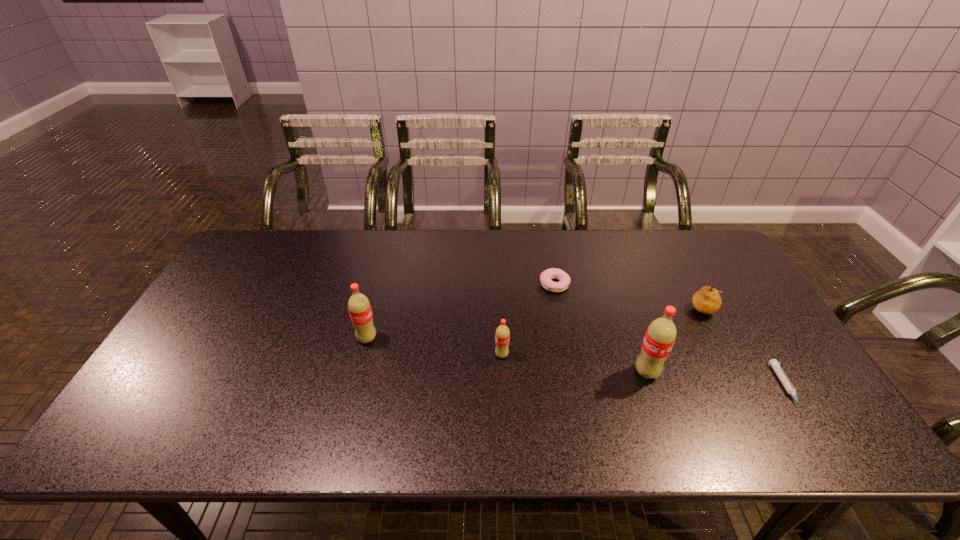
In order to click on the fifth shortest object in this screenshot , I will do 359,307.

You are a GUI agent. You are given a task and a screenshot of the screen. Output one action in this format:
    pyautogui.click(x=<x>, y=<y>)
    Task: Click on the second tallest soda
    This screenshot has width=960, height=540.
    Given the screenshot: What is the action you would take?
    pyautogui.click(x=359, y=307)

Identify the location of the second soda from right to left. The image size is (960, 540). (502, 334).

At what (x,y) coordinates should I click in order to perform the action: click on the second nearest soda. Please return your answer as a coordinate pair (x, y). The height and width of the screenshot is (540, 960). Looking at the image, I should click on (502, 334).

In order to click on the nearest soda in this screenshot , I will do `click(660, 336)`.

Identify the location of the fourth object from left to right. (660, 336).

Where is `pear`? pear is located at coordinates (707, 300).

The height and width of the screenshot is (540, 960). In order to click on the fourth tallest object in this screenshot , I will do `click(707, 300)`.

Find the location of a particular element. The width and height of the screenshot is (960, 540). the third object from left to right is located at coordinates (564, 279).

At what (x,y) coordinates should I click in order to perform the action: click on the farthest object. Please return your answer as a coordinate pair (x, y). Looking at the image, I should click on (564, 279).